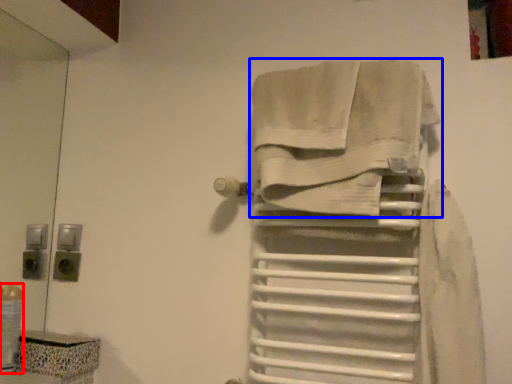
Question: Which object appears closest to the camera in this image, toiletry (highlighted by a red box) or towel (highlighted by a blue box)?

Choices:
 (A) toiletry
 (B) towel

Answer: (B)